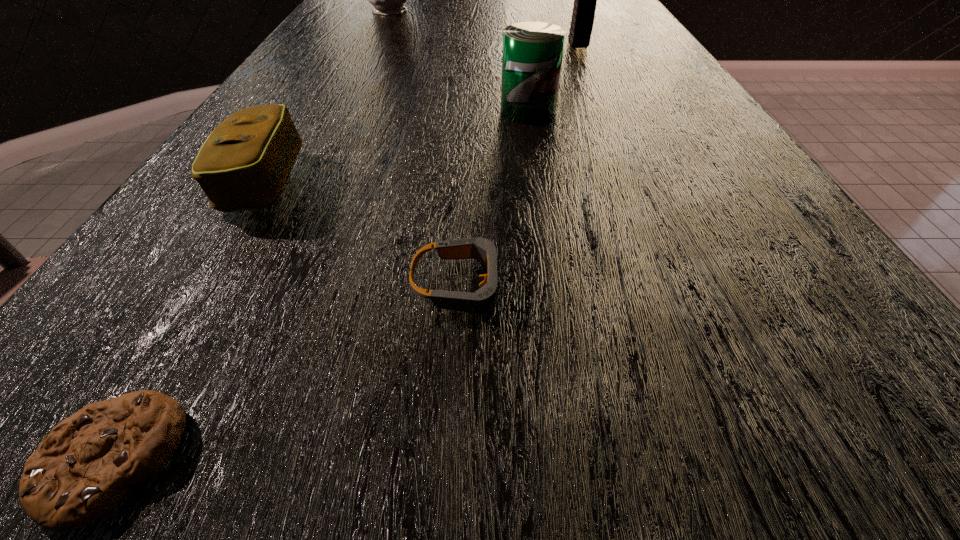
The height and width of the screenshot is (540, 960). I want to click on vacant area at the left edge of the desktop, so click(334, 96).

The image size is (960, 540). Identify the location of free spot at the right edge of the desktop. (695, 108).

This screenshot has height=540, width=960. In the image, there is a desktop. In order to click on vacant space at the near right corner in this screenshot , I will do `click(848, 489)`.

Find the location of a particular element. unoccupied area between the fourth farthest object and the third object from right to left is located at coordinates (364, 233).

Image resolution: width=960 pixels, height=540 pixels. I want to click on free point between the goggles and the chinaware, so click(427, 148).

The width and height of the screenshot is (960, 540). Identify the location of vacant area between the fifth farthest object and the taller clutch bag. (519, 165).

Identify the location of vacant space that is in between the farthest object and the fourth tallest object. (329, 96).

The height and width of the screenshot is (540, 960). Find the location of `vacant space that is in between the fourth nearest object and the farthest object`. vacant space that is in between the fourth nearest object and the farthest object is located at coordinates (460, 61).

Where is `free space that is in between the chinaware and the second object from right to left`? This screenshot has height=540, width=960. free space that is in between the chinaware and the second object from right to left is located at coordinates (460, 61).

Identify the location of vacant space that's between the rightmost object and the farthest object. The image size is (960, 540). (485, 27).